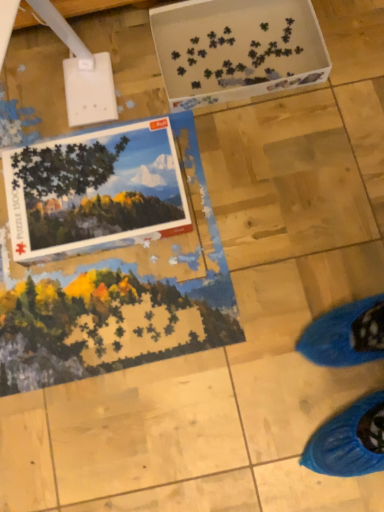
What is the approximate height of matte cardboard puzzle box at upper left?

matte cardboard puzzle box at upper left is 2.15 inches tall.

This screenshot has width=384, height=512. Describe the element at coordinates (94, 189) in the screenshot. I see `matte cardboard puzzle box at upper left` at that location.

Locate an element on the screen. Image resolution: width=384 pixels, height=512 pixels. matte cardboard puzzle box at upper left is located at coordinates (94, 189).

What do you see at coordinates (236, 49) in the screenshot? I see `white plastic puzzle pieces at upper center` at bounding box center [236, 49].

Find the location of a particular element. The image size is (384, 512). white plastic puzzle pieces at upper center is located at coordinates (236, 49).

You are a GUI agent. You are given a task and a screenshot of the screen. Output one action in this format:
    pyautogui.click(x=<x>, y=<y>)
    Task: Click on the matte cardboard puzzle box at upper left
    The width and height of the screenshot is (384, 512).
    Given the screenshot: What is the action you would take?
    pyautogui.click(x=94, y=189)

Which object is positioned more to the left, white plastic puzzle pieces at upper center or matte cardboard puzzle box at upper left?

matte cardboard puzzle box at upper left.

Relative to matte cardboard puzzle box at upper left, is white plastic puzzle pieces at upper center in front or behind?

Clearly, white plastic puzzle pieces at upper center is behind matte cardboard puzzle box at upper left.

Considering the points (276, 26) and (70, 156), which point is in front, point (276, 26) or point (70, 156)?

The point (70, 156) is closer.

From the image's perspective, between white plastic puzzle pieces at upper center and matte cardboard puzzle box at upper left, which one is located above?

From the image's view, white plastic puzzle pieces at upper center is above.

From a real-world perspective, is white plastic puzzle pieces at upper center located beneath matte cardboard puzzle box at upper left?

Yes, from a real-world perspective, white plastic puzzle pieces at upper center is below matte cardboard puzzle box at upper left.

Is white plastic puzzle pieces at upper center thinner than matte cardboard puzzle box at upper left?

No, white plastic puzzle pieces at upper center is not thinner than matte cardboard puzzle box at upper left.

Between white plastic puzzle pieces at upper center and matte cardboard puzzle box at upper left, which one has more height?

white plastic puzzle pieces at upper center is taller.

Who is smaller, white plastic puzzle pieces at upper center or matte cardboard puzzle box at upper left?

matte cardboard puzzle box at upper left is smaller.

Could matte cardboard puzzle box at upper left be considered to be inside white plastic puzzle pieces at upper center?

Definitely not — matte cardboard puzzle box at upper left is not inside white plastic puzzle pieces at upper center.

Based on the photo, is white plastic puzzle pieces at upper center far away from matte cardboard puzzle box at upper left?

They are positioned close to each other.

Is white plastic puzzle pieces at upper center positioned with its back to matte cardboard puzzle box at upper left?

No, white plastic puzzle pieces at upper center's orientation is not away from matte cardboard puzzle box at upper left.

Can you tell me how much white plastic puzzle pieces at upper center and matte cardboard puzzle box at upper left differ in facing direction?

0.000427 degrees.

There is a white plastic puzzle pieces at upper center. At what (x,y) coordinates should I click in order to perform the action: click on postcard above it (from a real-world perspective). Please return your answer as a coordinate pair (x, y). The image size is (384, 512). Looking at the image, I should click on (94, 189).

Is matte cardboard puzzle box at upper left at the left side of white plastic puzzle pieces at upper center?

Yes.

Is the position of matte cardboard puzzle box at upper left more distant than that of white plastic puzzle pieces at upper center?

No, matte cardboard puzzle box at upper left is closer to the camera.

Which is closer to the camera, (x=113, y=161) or (x=288, y=45)?

The point (x=113, y=161) is closer to the camera.

From the image's perspective, is matte cardboard puzzle box at upper left beneath white plastic puzzle pieces at upper center?

Yes, from the image's perspective, matte cardboard puzzle box at upper left is beneath white plastic puzzle pieces at upper center.

From a real-world perspective, who is located lower, matte cardboard puzzle box at upper left or white plastic puzzle pieces at upper center?

white plastic puzzle pieces at upper center is physically lower.

Based on the photo, is matte cardboard puzzle box at upper left wider or thinner than white plastic puzzle pieces at upper center?

Clearly, matte cardboard puzzle box at upper left has less width compared to white plastic puzzle pieces at upper center.

Is matte cardboard puzzle box at upper left taller or shorter than white plastic puzzle pieces at upper center?

matte cardboard puzzle box at upper left is shorter than white plastic puzzle pieces at upper center.

Does matte cardboard puzzle box at upper left have a smaller size compared to white plastic puzzle pieces at upper center?

Indeed, matte cardboard puzzle box at upper left has a smaller size compared to white plastic puzzle pieces at upper center.

Choose the correct answer: Is matte cardboard puzzle box at upper left inside white plastic puzzle pieces at upper center or outside it?

matte cardboard puzzle box at upper left is not enclosed by white plastic puzzle pieces at upper center.

Is there a large distance between matte cardboard puzzle box at upper left and white plastic puzzle pieces at upper center?

They are positioned close to each other.

Could you tell me if matte cardboard puzzle box at upper left is turned towards white plastic puzzle pieces at upper center?

No.

I want to click on postcard below the white plastic puzzle pieces at upper center (from the image's perspective), so click(x=94, y=189).

Locate an element on the screen. Image resolution: width=384 pixels, height=512 pixels. postcard on the left of the white plastic puzzle pieces at upper center is located at coordinates (94, 189).

Locate an element on the screen. The image size is (384, 512). cardboard box behind the matte cardboard puzzle box at upper left is located at coordinates (236, 49).